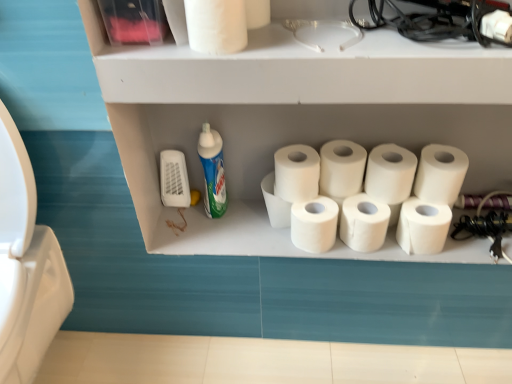
Identify the location of unoccupied area in front of blue glossy bottle at center-left. (216, 236).